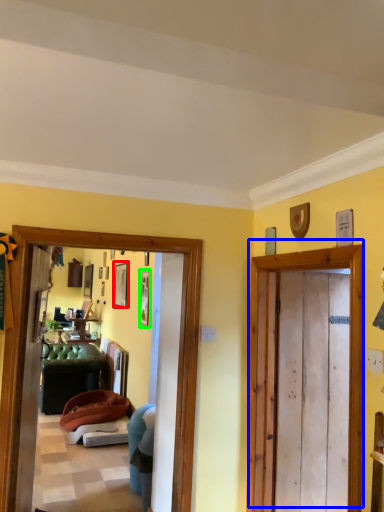
Question: Considering the real-world distances, which object is closest to picture frame (highlighted by a red box)? door (highlighted by a blue box) or picture frame (highlighted by a green box).

Choices:
 (A) door
 (B) picture frame

Answer: (B)